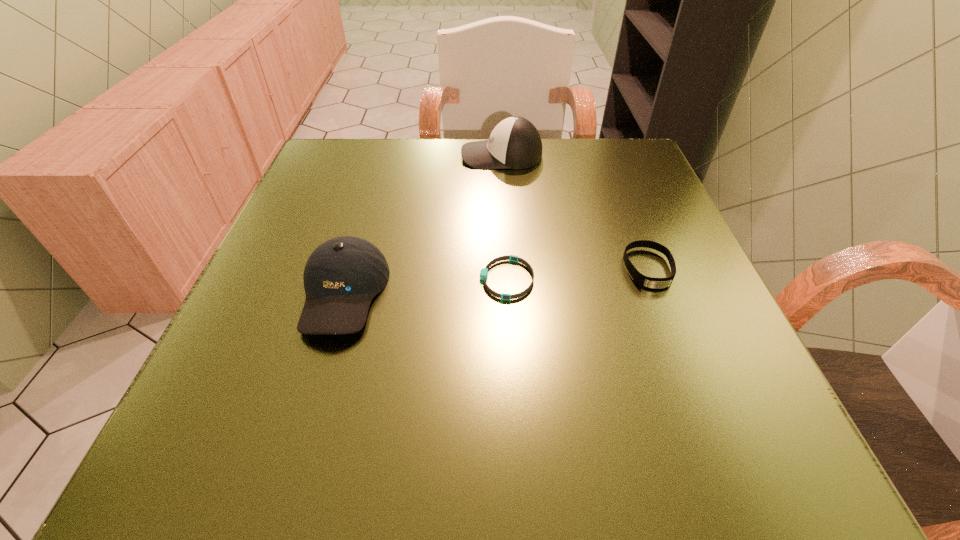
The image size is (960, 540). Find the location of `cap`. cap is located at coordinates pos(515,143).

You are a GUI agent. You are given a task and a screenshot of the screen. Output one action in this format:
    pyautogui.click(x=<x>, y=<y>)
    Task: Click on the farthest object
    The image size is (960, 540).
    Given the screenshot: What is the action you would take?
    pyautogui.click(x=515, y=143)

Identify the location of baseball cap. (342, 275).

The image size is (960, 540). I want to click on the second tallest object, so click(342, 275).

Locate an element on the screen. the rightmost object is located at coordinates (647, 282).

This screenshot has height=540, width=960. What are the coordinates of `the right wristband` in the screenshot? It's located at (647, 282).

Find the location of `the left wristband`. the left wristband is located at coordinates (484, 271).

Where is `the shortest object`? This screenshot has height=540, width=960. the shortest object is located at coordinates (484, 271).

Identify the location of vacant region located 0.060m on the front panel of the farthest object. This screenshot has width=960, height=540. (436, 156).

I want to click on free space located on the front panel of the farthest object, so click(x=318, y=156).